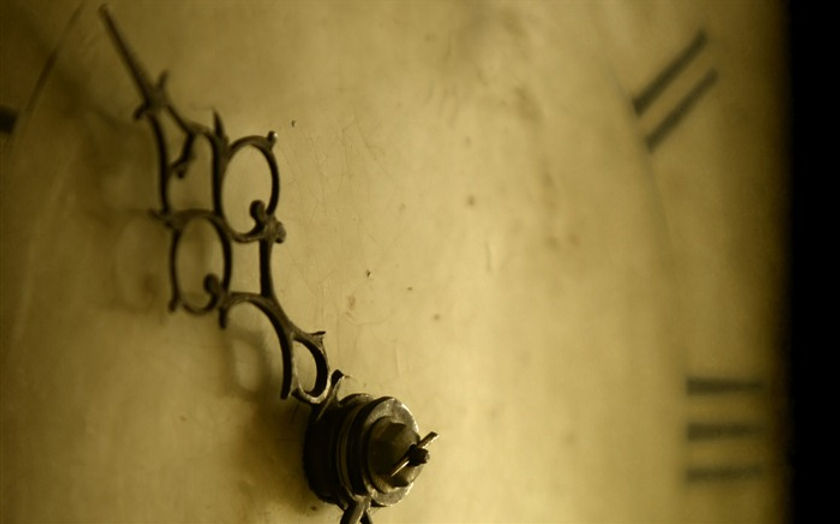
Where is `clock`? clock is located at coordinates (412, 264).